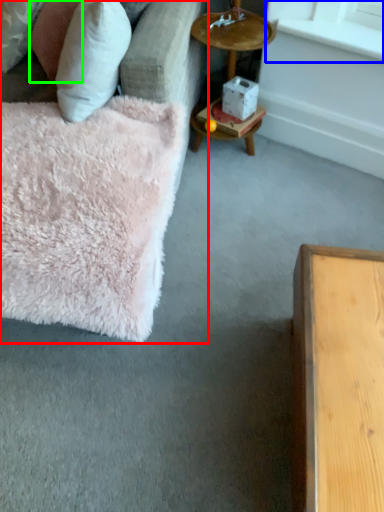
Question: Which object is positioned closest to studio couch (highlighted by a red box)? Select from window sill (highlighted by a blue box) and pillow (highlighted by a green box).

Choices:
 (A) window sill
 (B) pillow

Answer: (B)